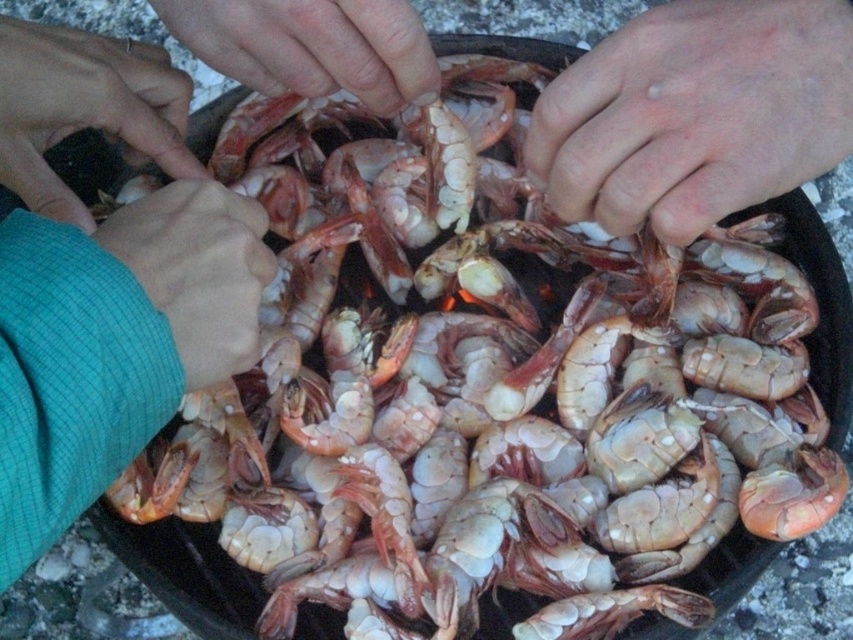
You are a chef holding a black cast iron skillet with cooked shrimp. You notice a smooth skin hand at upper center in the image. Where exactly is this hand positioned relative to the skillet?

The smooth skin hand at upper center is located at point coordinates [311,45] relative to the skillet.

You are holding a small spoon that is 6 inches long. You want to reach the shrimp in the skillet without moving the skillet. Can you reach the shrimp at point (703, 100) with your spoon?

The point (703, 100) is 19.85 inches away from the viewer. Since the spoon is only 6 inches long, it is not long enough to reach that point. You would need a longer utensil to reach the shrimp at that location.

You are a chef preparing a dish and need to lift the skillet from the heat. You see a smooth skin hand at upper center and a green textured sleeve at lower left. Which object is bigger in size?

The smooth skin hand at upper center has a larger size compared to the green textured sleeve at lower left, so the smooth skin hand at upper center is bigger.